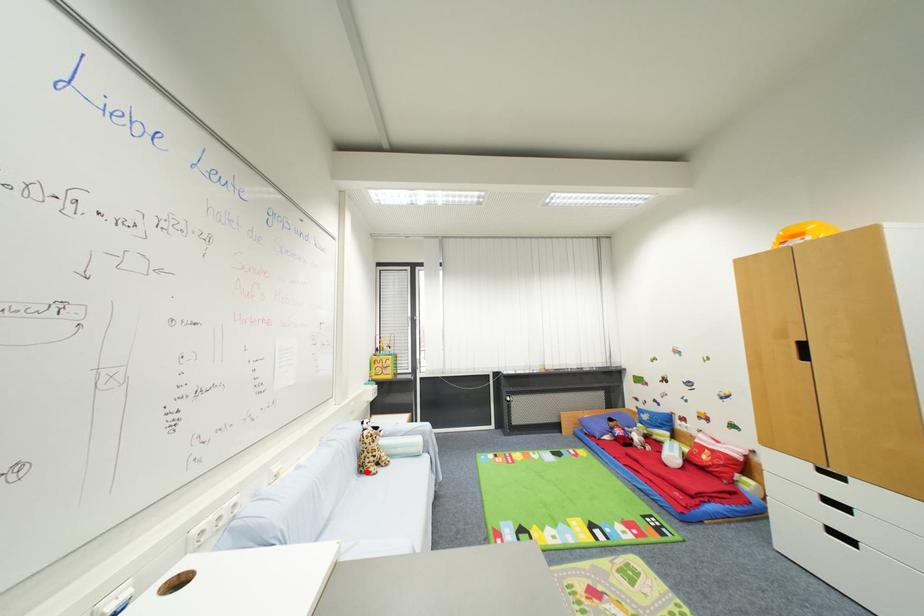
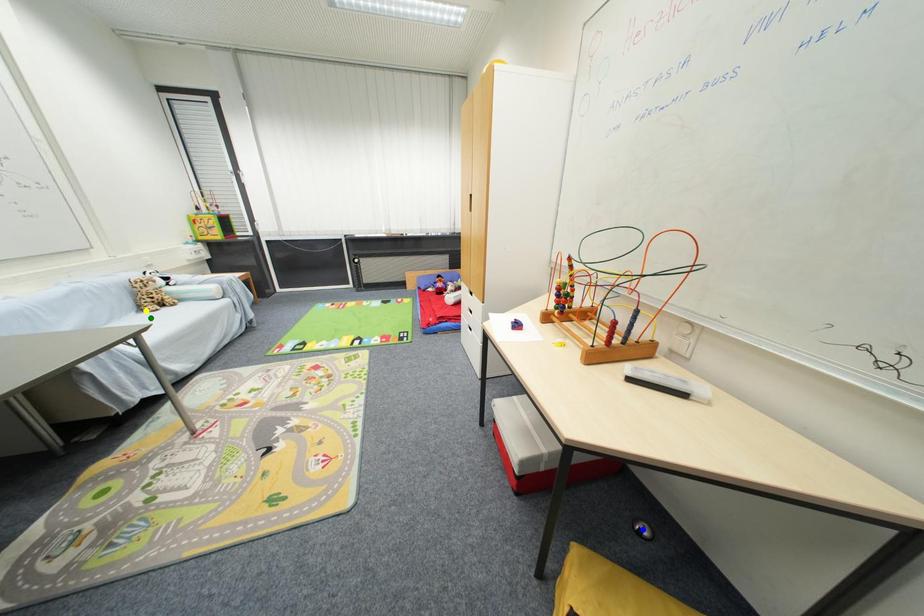
Question: I am providing you with two images of the same scene from different viewpoints. A red point is marked on the first image. You are given multiple points on the second image. Which point in image 2 is actually the same real-world point as the red point in image 1?

Choices:
 (A) green point
 (B) yellow point
 (C) blue point

Answer: (B)